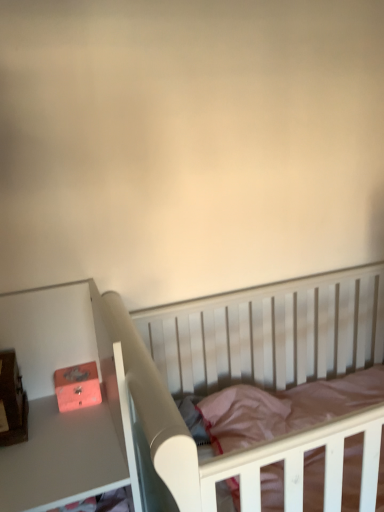
Question: Does matte pink drawer at left have a larger size compared to matte orange box at left?

Choices:
 (A) no
 (B) yes

Answer: (B)

Question: Is matte pink drawer at left closer to camera compared to matte orange box at left?

Choices:
 (A) yes
 (B) no

Answer: (A)

Question: Does matte pink drawer at left have a greater width compared to matte orange box at left?

Choices:
 (A) yes
 (B) no

Answer: (A)

Question: Is matte pink drawer at left far away from matte orange box at left?

Choices:
 (A) no
 (B) yes

Answer: (A)

Question: Can you confirm if matte pink drawer at left is positioned to the right of matte orange box at left?

Choices:
 (A) yes
 (B) no

Answer: (B)

Question: Would you say matte orange box at left is to the left or to the right of matte pink drawer at left in the picture?

Choices:
 (A) left
 (B) right

Answer: (B)

Question: Would you say matte orange box at left is inside or outside matte pink drawer at left?

Choices:
 (A) inside
 (B) outside

Answer: (A)

Question: Is matte orange box at left in front of or behind matte pink drawer at left in the image?

Choices:
 (A) behind
 (B) front

Answer: (A)

Question: In terms of size, does matte orange box at left appear bigger or smaller than matte pink drawer at left?

Choices:
 (A) big
 (B) small

Answer: (B)

Question: In terms of size, does white wood crib at center appear bigger or smaller than matte pink drawer at left?

Choices:
 (A) small
 (B) big

Answer: (B)

Question: Considering the relative positions of white wood crib at center and matte pink drawer at left in the image provided, is white wood crib at center to the left or to the right of matte pink drawer at left?

Choices:
 (A) left
 (B) right

Answer: (B)

Question: Considering the positions of point (332, 323) and point (39, 370), is point (332, 323) closer or farther from the camera than point (39, 370)?

Choices:
 (A) closer
 (B) farther

Answer: (B)

Question: From a real-world perspective, relative to matte pink drawer at left, is white wood crib at center vertically above or below?

Choices:
 (A) below
 (B) above

Answer: (A)

Question: Does point (79, 389) appear closer or farther from the camera than point (302, 362)?

Choices:
 (A) closer
 (B) farther

Answer: (A)

Question: Is matte orange box at left in front of or behind white wood crib at center in the image?

Choices:
 (A) front
 (B) behind

Answer: (B)